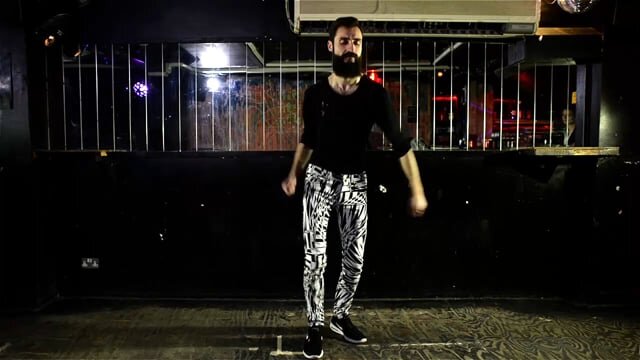
The height and width of the screenshot is (360, 640). I want to click on vertical metal bars, so click(x=77, y=113), click(x=93, y=99), click(x=115, y=93), click(x=467, y=92), click(x=502, y=85), click(x=550, y=85), click(x=531, y=89), click(x=232, y=94).